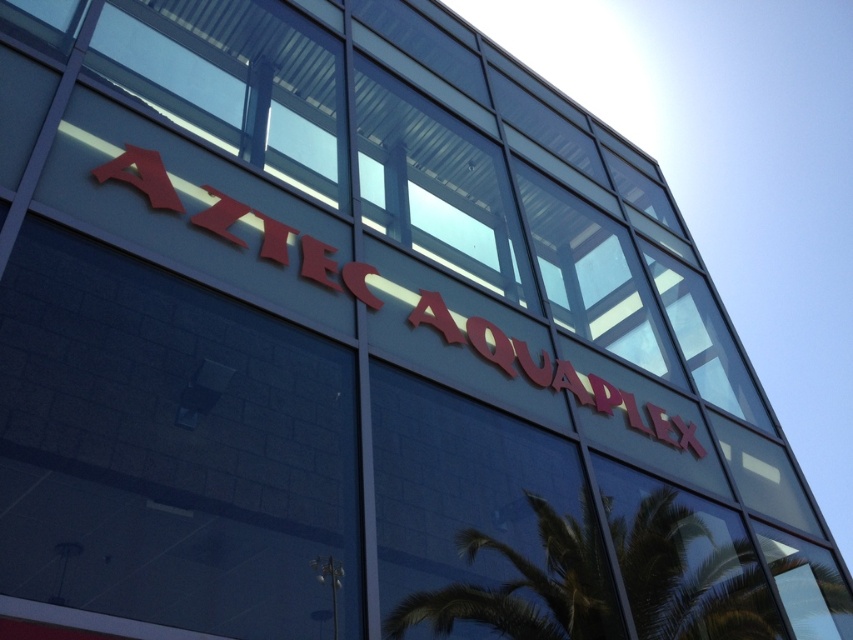
Question: Is green leafy palm tree at lower right bigger than red glossy sign at upper center?

Choices:
 (A) no
 (B) yes

Answer: (A)

Question: Which of the following is the closest to the observer?

Choices:
 (A) red glossy sign at upper center
 (B) green leafy palm tree at lower right

Answer: (B)

Question: Which of the following is the farthest from the observer?

Choices:
 (A) green leafy palm tree at lower right
 (B) red glossy sign at upper center

Answer: (B)

Question: Is green leafy palm tree at lower right to the left of red glossy sign at upper center from the viewer's perspective?

Choices:
 (A) yes
 (B) no

Answer: (B)

Question: Can you confirm if green leafy palm tree at lower right is bigger than red glossy sign at upper center?

Choices:
 (A) no
 (B) yes

Answer: (A)

Question: Which point is closer to the camera?

Choices:
 (A) (564, 545)
 (B) (390, 282)

Answer: (A)